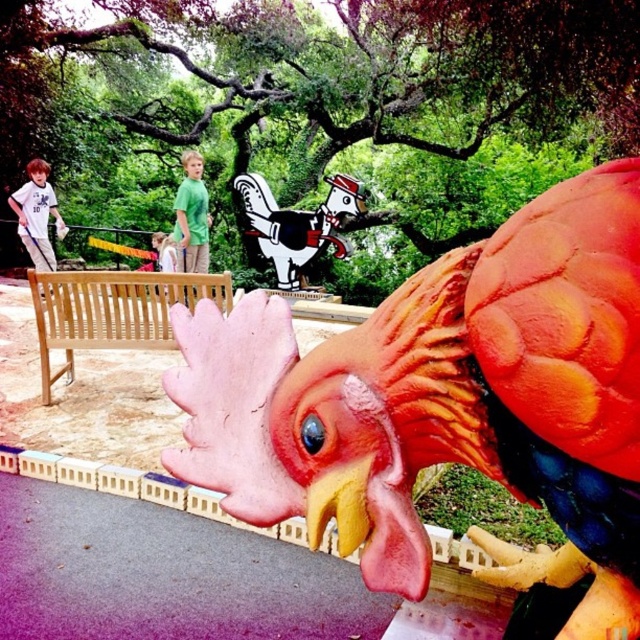
Question: Can you confirm if matte white shirt at left is positioned to the right of green matte shirt at center?

Choices:
 (A) yes
 (B) no

Answer: (B)

Question: Does light brown wooden bench at center have a larger size compared to matte white shirt at left?

Choices:
 (A) yes
 (B) no

Answer: (A)

Question: Which point is closer to the camera taking this photo?

Choices:
 (A) (298, 273)
 (B) (24, 224)
 (C) (68, 381)
 (D) (179, 220)

Answer: (C)

Question: Which of these objects is positioned farthest from the light brown wooden bench at center?

Choices:
 (A) rubber chicken at center
 (B) green matte shirt at center
 (C) matte white shirt at left
 (D) cartoon chicken at center

Answer: (D)

Question: Which point is farther to the camera?

Choices:
 (A) matte white shirt at left
 (B) light brown wooden bench at center
 (C) green matte shirt at center
 (D) cartoon chicken at center

Answer: (D)

Question: Can you confirm if rubber chicken at center is bigger than matte white shirt at left?

Choices:
 (A) no
 (B) yes

Answer: (B)